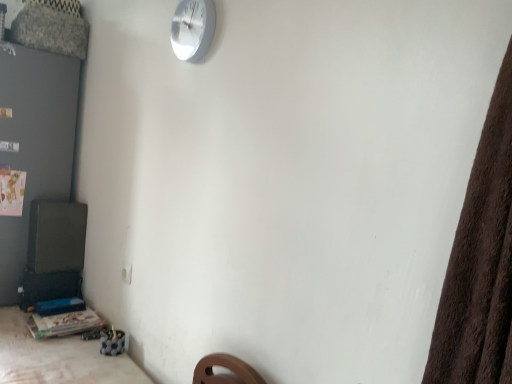
Question: Considering the relative sizes of wooden table at lower left and white metallic wall clock at upper center in the image provided, is wooden table at lower left wider than white metallic wall clock at upper center?

Choices:
 (A) yes
 (B) no

Answer: (A)

Question: Would you say wooden table at lower left is outside white metallic wall clock at upper center?

Choices:
 (A) yes
 (B) no

Answer: (A)

Question: Does wooden table at lower left have a larger size compared to white metallic wall clock at upper center?

Choices:
 (A) yes
 (B) no

Answer: (A)

Question: From the image's perspective, is wooden table at lower left on top of white metallic wall clock at upper center?

Choices:
 (A) no
 (B) yes

Answer: (A)

Question: Can you confirm if wooden table at lower left is positioned to the left of white metallic wall clock at upper center?

Choices:
 (A) yes
 (B) no

Answer: (A)

Question: In the image, is wooden table at lower left positioned in front of or behind white metallic wall clock at upper center?

Choices:
 (A) behind
 (B) front

Answer: (B)

Question: From the image's perspective, relative to white metallic wall clock at upper center, is wooden table at lower left above or below?

Choices:
 (A) above
 (B) below

Answer: (B)

Question: Is wooden table at lower left taller or shorter than white metallic wall clock at upper center?

Choices:
 (A) tall
 (B) short

Answer: (A)

Question: In terms of width, does wooden table at lower left look wider or thinner when compared to white metallic wall clock at upper center?

Choices:
 (A) wide
 (B) thin

Answer: (A)

Question: Would you say white metallic wall clock at upper center is inside or outside wooden table at lower left?

Choices:
 (A) inside
 (B) outside

Answer: (B)

Question: Is white metallic wall clock at upper center wider or thinner than wooden table at lower left?

Choices:
 (A) thin
 (B) wide

Answer: (A)

Question: Considering the positions of white metallic wall clock at upper center and wooden table at lower left in the image, is white metallic wall clock at upper center taller or shorter than wooden table at lower left?

Choices:
 (A) short
 (B) tall

Answer: (B)

Question: From the image's perspective, is white metallic wall clock at upper center positioned above or below wooden table at lower left?

Choices:
 (A) below
 (B) above

Answer: (B)

Question: Considering the positions of white metallic wall clock at upper center and wooden table at lower left in the image, is white metallic wall clock at upper center wider or thinner than wooden table at lower left?

Choices:
 (A) thin
 (B) wide

Answer: (A)

Question: Looking at the image, does white metallic wall clock at upper center seem bigger or smaller compared to wooden table at lower left?

Choices:
 (A) small
 (B) big

Answer: (A)